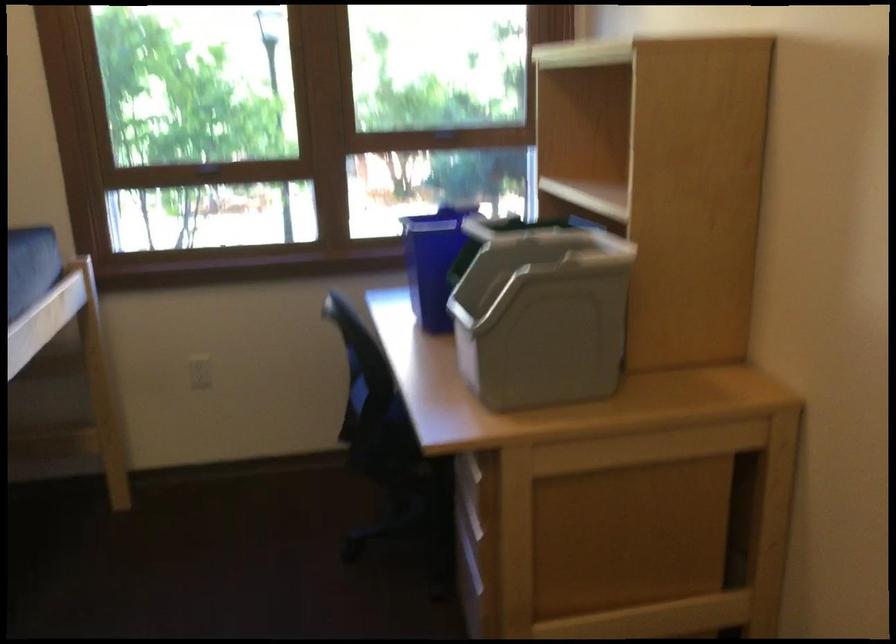
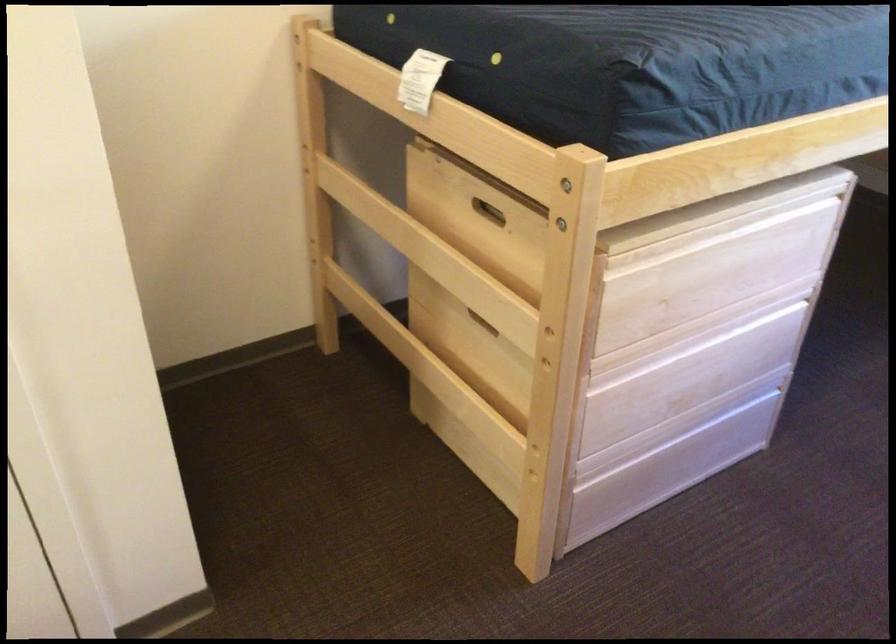
First-person continuous shooting, in which direction is the camera rotating?

The rotation direction of the camera is left-down.